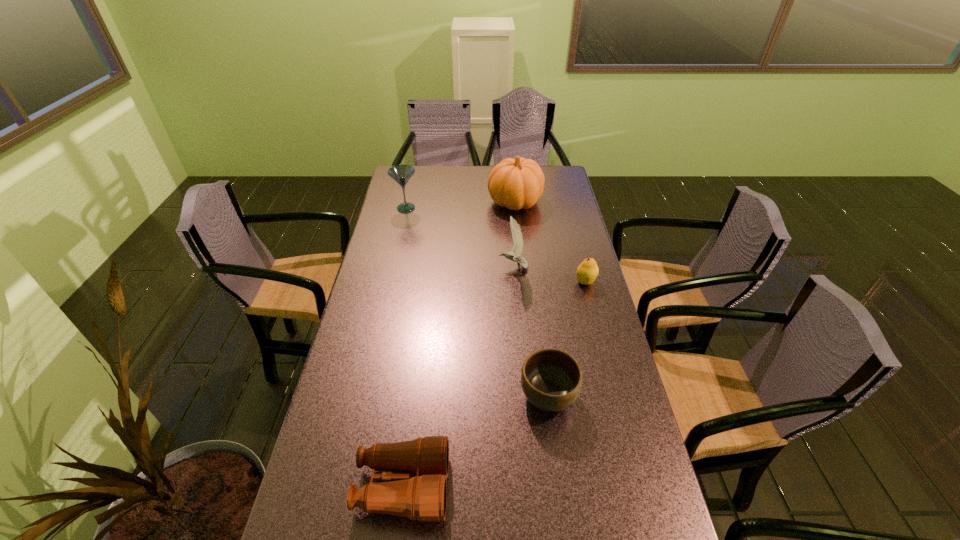
Find the location of `vacant region between the gull and the second tallest object`. vacant region between the gull and the second tallest object is located at coordinates (460, 238).

You are a GUI agent. You are given a task and a screenshot of the screen. Output one action in this format:
    pyautogui.click(x=<x>, y=<y>)
    Task: Click on the free space between the bowl and the tallest object
    
    Given the screenshot: What is the action you would take?
    pyautogui.click(x=532, y=299)

Find the location of `unoccupied area between the bowl and the binoculars`. unoccupied area between the bowl and the binoculars is located at coordinates (475, 441).

Where is `empty location between the binoculars and the rightmost object`? The image size is (960, 540). empty location between the binoculars and the rightmost object is located at coordinates (494, 384).

Locate which object ranks fifth in proximity to the fifth farthest object. Please provide its 2D coordinates. Your answer should be formatted as a tuple, i.e. [(x, y)], where the tuple contains the x and y coordinates of a point satisfying the conditions above.

[(401, 174)]

Find the location of a particular element. the closest object to the rightmost object is located at coordinates (517, 249).

Identify the location of free location that satisfies the following two spatial constraints: 1. on the front side of the pumpkin; 2. at the tip of the beak of the fourth shortest object. (522, 267).

What are the coordinates of `free point that satisfies the following two spatial constraints: 1. on the back side of the pear; 2. at the tip of the beak of the gull` in the screenshot? It's located at (582, 267).